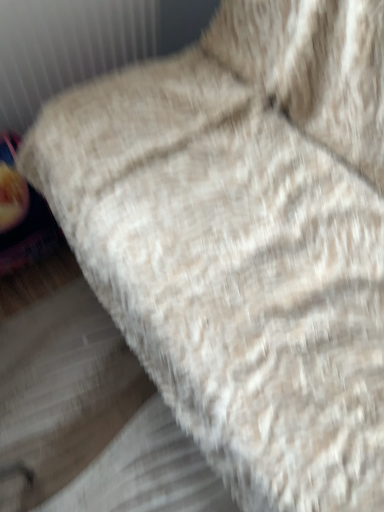
The image size is (384, 512). What do you see at coordinates (66, 48) in the screenshot?
I see `white textured radiator at upper left` at bounding box center [66, 48].

Locate an element on the screen. This screenshot has width=384, height=512. white textured radiator at upper left is located at coordinates (66, 48).

Where is `white textured radiator at upper left`? Image resolution: width=384 pixels, height=512 pixels. white textured radiator at upper left is located at coordinates (66, 48).